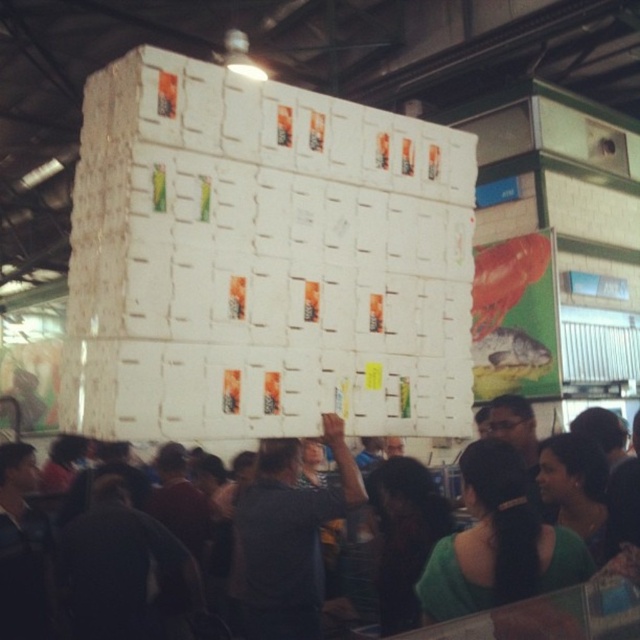
You are a photographer standing in the market and want to capture a photo of the dark gray fabric shirt at center and the matte white boxes at center. Which object is narrower when viewed from your perspective?

The dark gray fabric shirt at center is narrower than the matte white boxes at center.

You are a photographer at the market and want to capture a photo of the matte white boxes at center without any people blocking them. Based on the scene, can you position yourself in a way to avoid the dark gray fabric shirt at center?

The dark gray fabric shirt at center is below the matte white boxes at center, so positioning yourself above or behind the boxes would allow you to capture the matte white boxes at center without the shirt blocking the view.

You are a photographer standing in the market and want to capture both the dark gray fabric shirt at center and the matte white boxes at center in the same frame. Based on their heights, which object should you focus on to ensure both are fully visible?

The dark gray fabric shirt at center is much taller than the matte white boxes at center, so focusing on the dark gray fabric shirt at center will ensure both are fully visible in the frame.